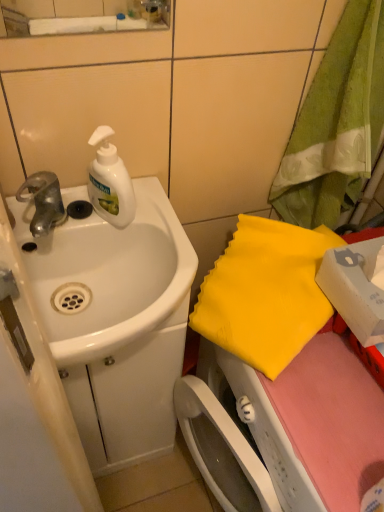
The image size is (384, 512). What do you see at coordinates (110, 182) in the screenshot? I see `white matte soap dispenser at upper left` at bounding box center [110, 182].

I want to click on white glossy sink at left, so click(x=109, y=275).

Locate an element on the screen. This screenshot has height=512, width=384. silver metallic faucet at left is located at coordinates (43, 201).

The width and height of the screenshot is (384, 512). Find the location of `yellow fabric at right, which ranks as the second beach towel in top-to-bottom order`. yellow fabric at right, which ranks as the second beach towel in top-to-bottom order is located at coordinates pyautogui.click(x=265, y=293).

From a real-world perspective, is yellow fabric at right, which ranks as the second beach towel in top-to-bottom order, physically above green fabric towel at upper right, marked as the first beach towel in a top-to-bottom arrangement?

No, from a real-world perspective, yellow fabric at right, which ranks as the second beach towel in top-to-bottom order, is not over green fabric towel at upper right, marked as the first beach towel in a top-to-bottom arrangement

Is yellow fabric at right, the 1th beach towel positioned from the bottom, taller or shorter than green fabric towel at upper right, marked as the first beach towel in a top-to-bottom arrangement?

Considering their sizes, yellow fabric at right, the 1th beach towel positioned from the bottom, has less height than green fabric towel at upper right, marked as the first beach towel in a top-to-bottom arrangement.

From the image's perspective, is yellow fabric at right, which ranks as the second beach towel in top-to-bottom order, on top of green fabric towel at upper right, marked as the first beach towel in a top-to-bottom arrangement?

No, from the image's perspective, yellow fabric at right, which ranks as the second beach towel in top-to-bottom order, is not above green fabric towel at upper right, marked as the first beach towel in a top-to-bottom arrangement.

Is point (298, 258) closer to camera compared to point (362, 2)?

No, (298, 258) is behind (362, 2).

Which object is positioned more to the left, silver metallic faucet at left or white matte soap dispenser at upper left?

silver metallic faucet at left.

Is white matte soap dispenser at upper left a part of silver metallic faucet at left?

No, white matte soap dispenser at upper left is not inside silver metallic faucet at left.

Between silver metallic faucet at left and white matte soap dispenser at upper left, which one has larger size?

white matte soap dispenser at upper left.

From a real-world perspective, is green fabric towel at upper right, which ranks as the 2th beach towel in bottom-to-top order, under silver metallic faucet at left?

Incorrect, from a real-world perspective, green fabric towel at upper right, which ranks as the 2th beach towel in bottom-to-top order, is higher than silver metallic faucet at left.

Is green fabric towel at upper right, which ranks as the 2th beach towel in bottom-to-top order, wider or thinner than silver metallic faucet at left?

Considering their sizes, green fabric towel at upper right, which ranks as the 2th beach towel in bottom-to-top order, looks broader than silver metallic faucet at left.

Do you think green fabric towel at upper right, marked as the first beach towel in a top-to-bottom arrangement, is within silver metallic faucet at left, or outside of it?

The correct answer is: outside.

Is point (69, 352) closer or farther from the camera than point (309, 218)?

Point (69, 352).

From a real-world perspective, is white glossy sink at left positioned above or below green fabric towel at upper right, which ranks as the 2th beach towel in bottom-to-top order?

Clearly, from a real-world perspective, white glossy sink at left is below green fabric towel at upper right, which ranks as the 2th beach towel in bottom-to-top order.

Can you confirm if white glossy sink at left is thinner than green fabric towel at upper right, which ranks as the 2th beach towel in bottom-to-top order?

In fact, white glossy sink at left might be wider than green fabric towel at upper right, which ranks as the 2th beach towel in bottom-to-top order.

Could you tell me if white glossy sink at left is turned towards green fabric towel at upper right, marked as the first beach towel in a top-to-bottom arrangement?

No, white glossy sink at left is not facing towards green fabric towel at upper right, marked as the first beach towel in a top-to-bottom arrangement.

Can we say yellow fabric at right, which ranks as the second beach towel in top-to-bottom order, lies outside silver metallic faucet at left?

Absolutely, yellow fabric at right, which ranks as the second beach towel in top-to-bottom order, is external to silver metallic faucet at left.

Visually, is yellow fabric at right, which ranks as the second beach towel in top-to-bottom order, positioned to the left or to the right of silver metallic faucet at left?

Clearly, yellow fabric at right, which ranks as the second beach towel in top-to-bottom order, is on the right of silver metallic faucet at left in the image.

Is yellow fabric at right, the 1th beach towel positioned from the bottom, oriented towards silver metallic faucet at left?

No, yellow fabric at right, the 1th beach towel positioned from the bottom, is not oriented towards silver metallic faucet at left.

Can you tell me how much yellow fabric at right, the 1th beach towel positioned from the bottom, and silver metallic faucet at left differ in facing direction?

yellow fabric at right, the 1th beach towel positioned from the bottom, and silver metallic faucet at left are facing 62.7 degrees away from each other.

Find the location of a particular element. Image resolution: width=384 pixels, height=512 pixels. sink in front of the yellow fabric at right, which ranks as the second beach towel in top-to-bottom order is located at coordinates (109, 275).

Does yellow fabric at right, which ranks as the second beach towel in top-to-bottom order, turn towards white glossy sink at left?

Yes, yellow fabric at right, which ranks as the second beach towel in top-to-bottom order, is aimed at white glossy sink at left.

From the image's perspective, which is above, yellow fabric at right, which ranks as the second beach towel in top-to-bottom order, or white glossy sink at left?

From the image's view, white glossy sink at left is above.

From a real-world perspective, between yellow fabric at right, which ranks as the second beach towel in top-to-bottom order, and white glossy sink at left, who is vertically lower?

yellow fabric at right, which ranks as the second beach towel in top-to-bottom order.

Could yellow fabric at right, the 1th beach towel positioned from the bottom, be considered to be inside green fabric towel at upper right, which ranks as the 2th beach towel in bottom-to-top order?

No, yellow fabric at right, the 1th beach towel positioned from the bottom, is not surrounded by green fabric towel at upper right, which ranks as the 2th beach towel in bottom-to-top order.

Can you confirm if green fabric towel at upper right, which ranks as the 2th beach towel in bottom-to-top order, is positioned to the left of yellow fabric at right, the 1th beach towel positioned from the bottom?

No.

Find the location of a particular element. Image resolution: width=384 pixels, height=512 pixels. beach towel lying in front of the yellow fabric at right, the 1th beach towel positioned from the bottom is located at coordinates [336, 124].

From the image's perspective, does green fabric towel at upper right, marked as the first beach towel in a top-to-bottom arrangement, appear lower than yellow fabric at right, the 1th beach towel positioned from the bottom?

No.

Where is `beach towel that appears below the green fabric towel at upper right, which ranks as the 2th beach towel in bottom-to-top order (from a real-world perspective)`? The image size is (384, 512). beach towel that appears below the green fabric towel at upper right, which ranks as the 2th beach towel in bottom-to-top order (from a real-world perspective) is located at coordinates (265, 293).

The image size is (384, 512). I want to click on soap dispenser above the silver metallic faucet at left (from the image's perspective), so pyautogui.click(x=110, y=182).

Based on their spatial positions, is green fabric towel at upper right, marked as the first beach towel in a top-to-bottom arrangement, or white glossy sink at left further from white matte soap dispenser at upper left?

green fabric towel at upper right, marked as the first beach towel in a top-to-bottom arrangement, lies further to white matte soap dispenser at upper left than the other object.

When comparing their distances from white matte soap dispenser at upper left, does yellow fabric at right, the 1th beach towel positioned from the bottom, or silver metallic faucet at left seem further?

Among the two, yellow fabric at right, the 1th beach towel positioned from the bottom, is located further to white matte soap dispenser at upper left.

Considering their positions, is green fabric towel at upper right, which ranks as the 2th beach towel in bottom-to-top order, positioned further to silver metallic faucet at left than yellow fabric at right, which ranks as the second beach towel in top-to-bottom order?

green fabric towel at upper right, which ranks as the 2th beach towel in bottom-to-top order, is further to silver metallic faucet at left.

Based on their spatial positions, is green fabric towel at upper right, marked as the first beach towel in a top-to-bottom arrangement, or silver metallic faucet at left closer to white matte soap dispenser at upper left?

silver metallic faucet at left lies closer to white matte soap dispenser at upper left than the other object.

From the image, which object appears to be nearer to white glossy sink at left, yellow fabric at right, the 1th beach towel positioned from the bottom, or silver metallic faucet at left?

silver metallic faucet at left.

Which object lies nearer to the anchor point silver metallic faucet at left, white glossy sink at left or white matte soap dispenser at upper left?

Based on the image, white matte soap dispenser at upper left appears to be nearer to silver metallic faucet at left.

Looking at the image, which one is located closer to white matte soap dispenser at upper left, white glossy sink at left or silver metallic faucet at left?

silver metallic faucet at left.

From the image, which object appears to be nearer to white glossy sink at left, white matte soap dispenser at upper left or yellow fabric at right, the 1th beach towel positioned from the bottom?

white matte soap dispenser at upper left is positioned closer to the anchor white glossy sink at left.

This screenshot has height=512, width=384. I want to click on soap dispenser located between silver metallic faucet at left and yellow fabric at right, the 1th beach towel positioned from the bottom, in the left-right direction, so click(x=110, y=182).

At what (x,y) coordinates should I click in order to perform the action: click on beach towel between silver metallic faucet at left and green fabric towel at upper right, which ranks as the 2th beach towel in bottom-to-top order. Please return your answer as a coordinate pair (x, y). Image resolution: width=384 pixels, height=512 pixels. Looking at the image, I should click on tap(265, 293).

Where is `sink between silver metallic faucet at left and yellow fabric at right, the 1th beach towel positioned from the bottom, in the horizontal direction`? This screenshot has height=512, width=384. sink between silver metallic faucet at left and yellow fabric at right, the 1th beach towel positioned from the bottom, in the horizontal direction is located at coordinates (109, 275).

This screenshot has height=512, width=384. What are the coordinates of `soap dispenser between white glossy sink at left and green fabric towel at upper right, marked as the first beach towel in a top-to-bottom arrangement, from left to right` in the screenshot? It's located at (110, 182).